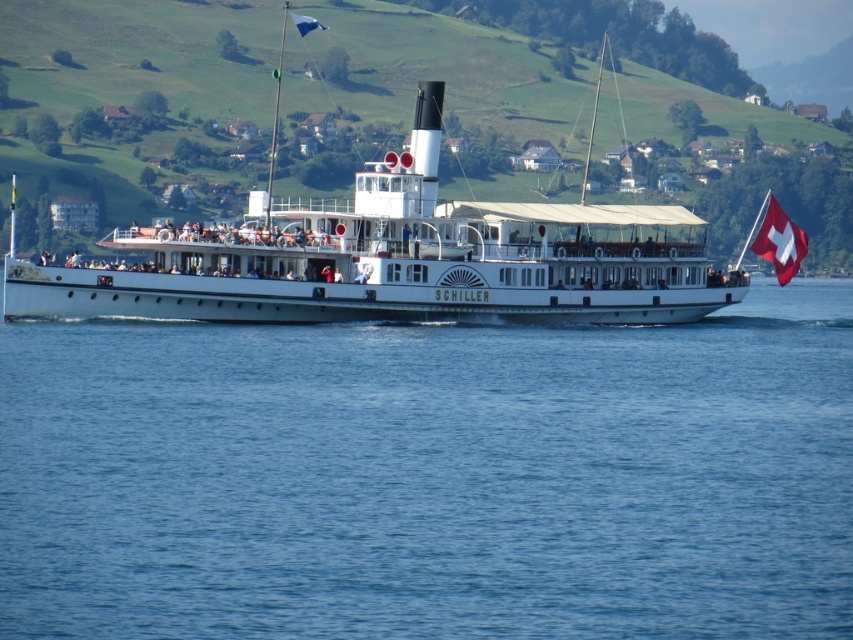
Question: Is blue water at center to the left of white matte steamboat at center from the viewer's perspective?

Choices:
 (A) yes
 (B) no

Answer: (B)

Question: Observing the image, what is the correct spatial positioning of blue water at center in reference to swiss flag at right?

Choices:
 (A) left
 (B) right

Answer: (A)

Question: Which point is farther from the camera taking this photo?

Choices:
 (A) (289, 227)
 (B) (767, 228)
 (C) (299, 29)

Answer: (C)

Question: Where is blue water at center located in relation to swiss flag at right in the image?

Choices:
 (A) above
 (B) below

Answer: (B)

Question: Considering the real-world distances, which object is closest to the white matte steamboat at center?

Choices:
 (A) blue fabric flag at upper center
 (B) blue water at center
 (C) swiss flag at right

Answer: (B)

Question: Estimate the real-world distances between objects in this image. Which object is closer to the blue water at center?

Choices:
 (A) white matte steamboat at center
 (B) swiss flag at right

Answer: (A)